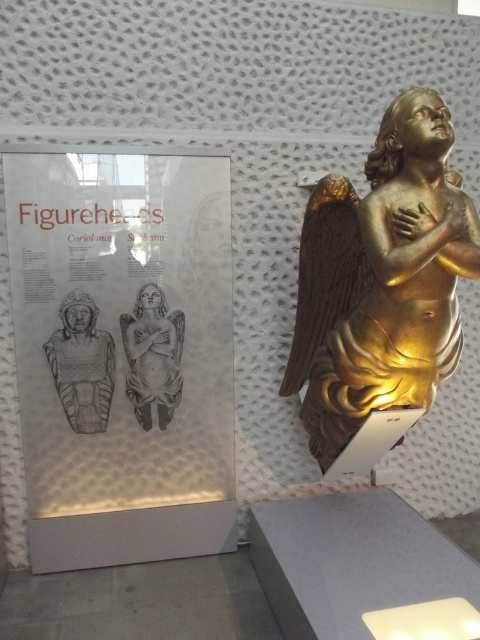
Question: Where is gold polished wood angel at right located in relation to matte stone figure at center in the image?

Choices:
 (A) below
 (B) above

Answer: (B)

Question: Is gold polished wood angel at right closer to the viewer compared to matte stone figure at center?

Choices:
 (A) no
 (B) yes

Answer: (B)

Question: Does matte stone figure at center appear under matte gray stone angel at center?

Choices:
 (A) no
 (B) yes

Answer: (B)

Question: Which object appears farthest from the camera in this image?

Choices:
 (A) gold polished wood angel at right
 (B) matte gray stone angel at center
 (C) matte stone figure at center

Answer: (B)

Question: Which object is closer to the camera taking this photo?

Choices:
 (A) matte stone figure at center
 (B) matte gray stone angel at center
 (C) gold polished wood angel at right

Answer: (C)

Question: Considering the real-world distances, which object is farthest from the gold polished wood angel at right?

Choices:
 (A) matte stone figure at center
 (B) matte gray stone angel at center

Answer: (A)